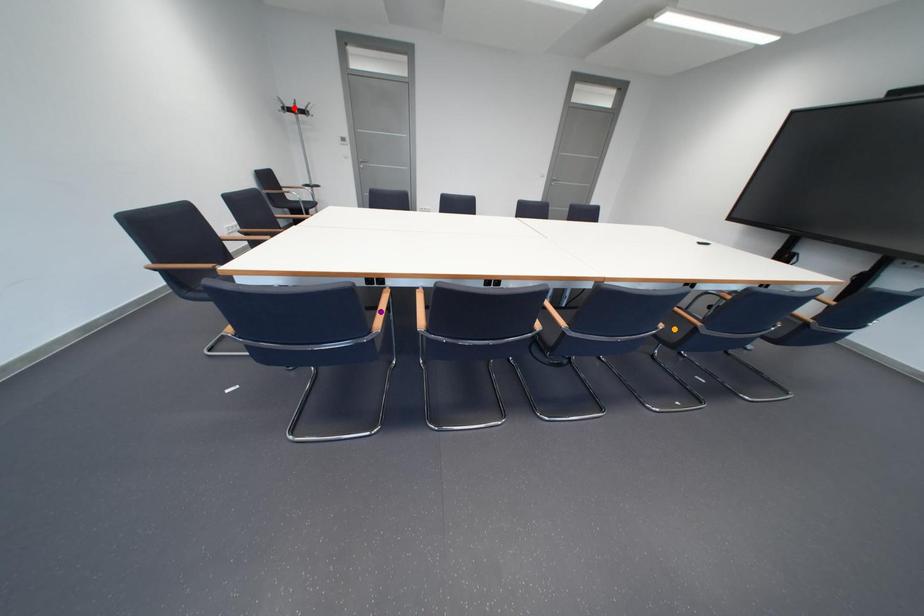
Order these from nearest to farthest:
orange point, purple point, red point

red point
orange point
purple point